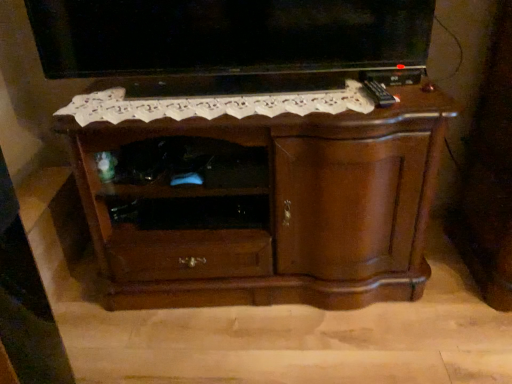
Where is `free space above shiny brown cabinet at center (from a real-world perspective)`? free space above shiny brown cabinet at center (from a real-world perspective) is located at coordinates (251, 99).